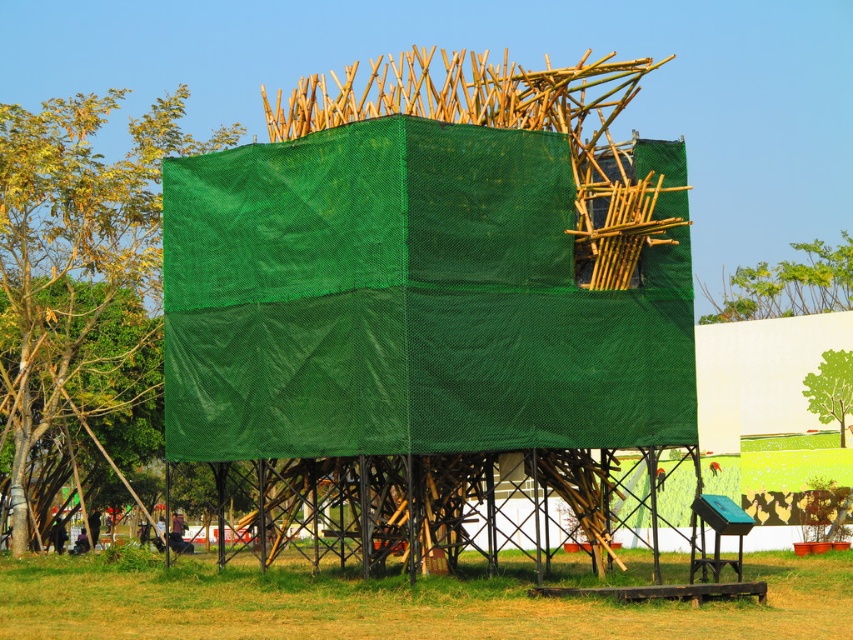
Does green mesh tree at upper left have a smaller size compared to green leafy tree at upper center?

No, green mesh tree at upper left is not smaller than green leafy tree at upper center.

Between green mesh tree at upper left and green leafy tree at upper center, which one is positioned higher?

green mesh tree at upper left is higher up.

Which is behind, point (15, 116) or point (840, 362)?

The point (840, 362) is behind.

Find the location of a particular element. green mesh tree at upper left is located at coordinates (79, 266).

Who is positioned more to the left, green mesh tree at upper left or green leafy tree at upper right?

From the viewer's perspective, green mesh tree at upper left appears more on the left side.

Does green mesh tree at upper left have a larger size compared to green leafy tree at upper right?

Correct, green mesh tree at upper left is larger in size than green leafy tree at upper right.

I want to click on green mesh tree at upper left, so click(x=79, y=266).

You are a GUI agent. You are given a task and a screenshot of the screen. Output one action in this format:
    pyautogui.click(x=<x>, y=<y>)
    Task: Click on the green leafy tree at upper right
    
    Given the screenshot: What is the action you would take?
    (787, 285)

Does green leafy tree at upper right have a greater width compared to green leafy tree at upper center?

Correct, the width of green leafy tree at upper right exceeds that of green leafy tree at upper center.

The height and width of the screenshot is (640, 853). I want to click on green leafy tree at upper right, so click(x=787, y=285).